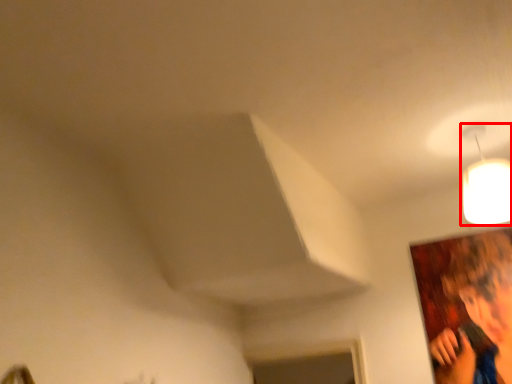
Question: From the image's perspective, where is lamp (annotated by the red box) located relative to person?

Choices:
 (A) below
 (B) above

Answer: (B)